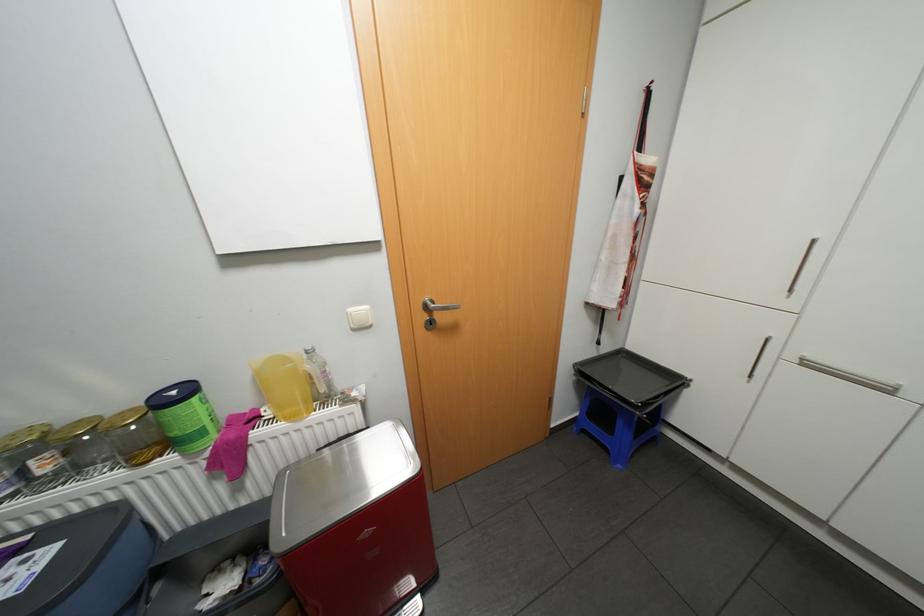
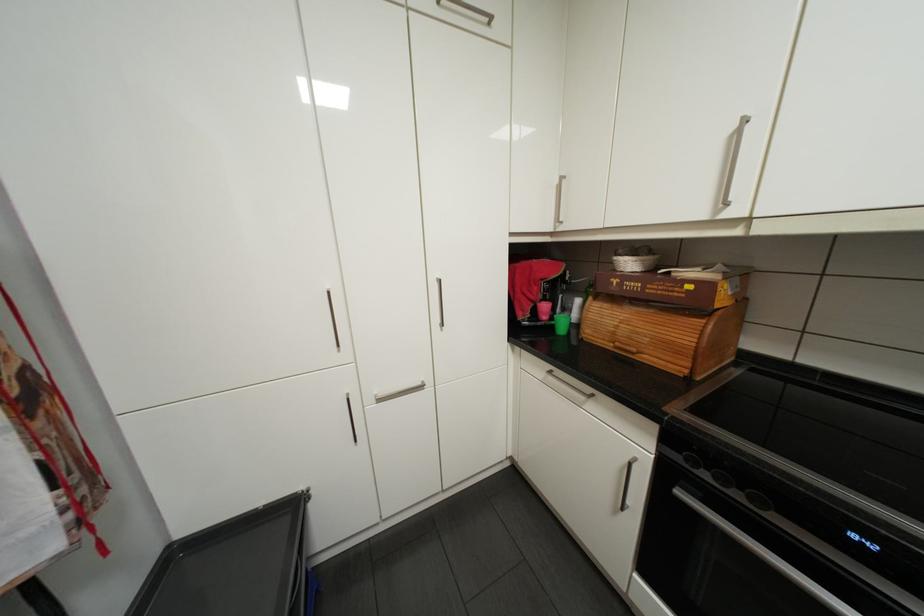
Find the pixel in the second image that matches point 684,379 in the first image.

(300, 507)